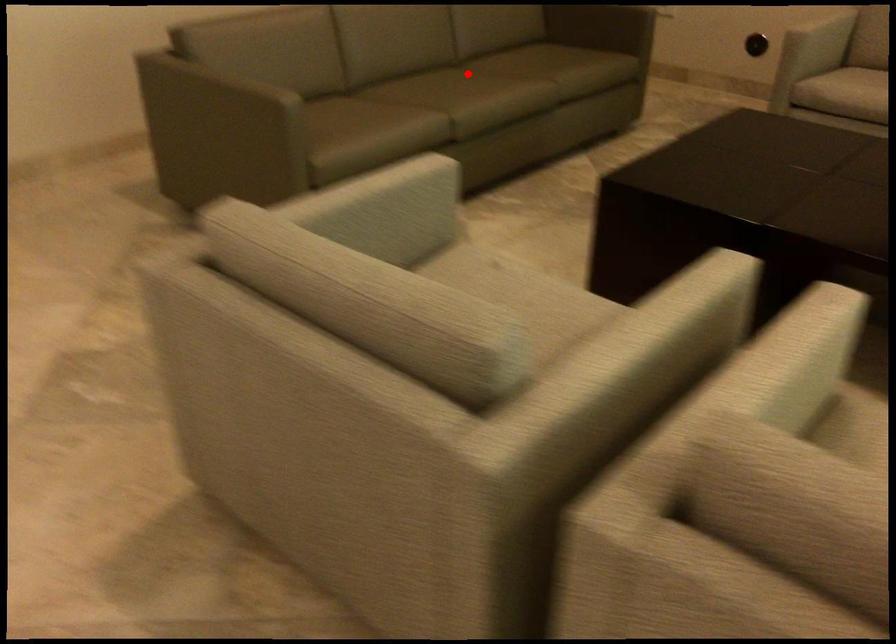
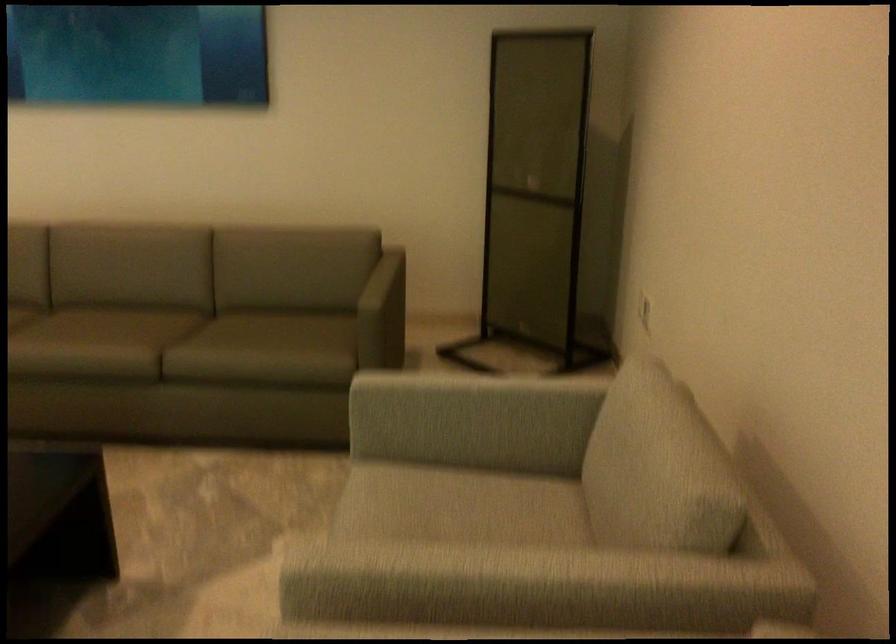
Locate, in the second image, the point that corresponds to the highlighted location in the first image.

(128, 327)